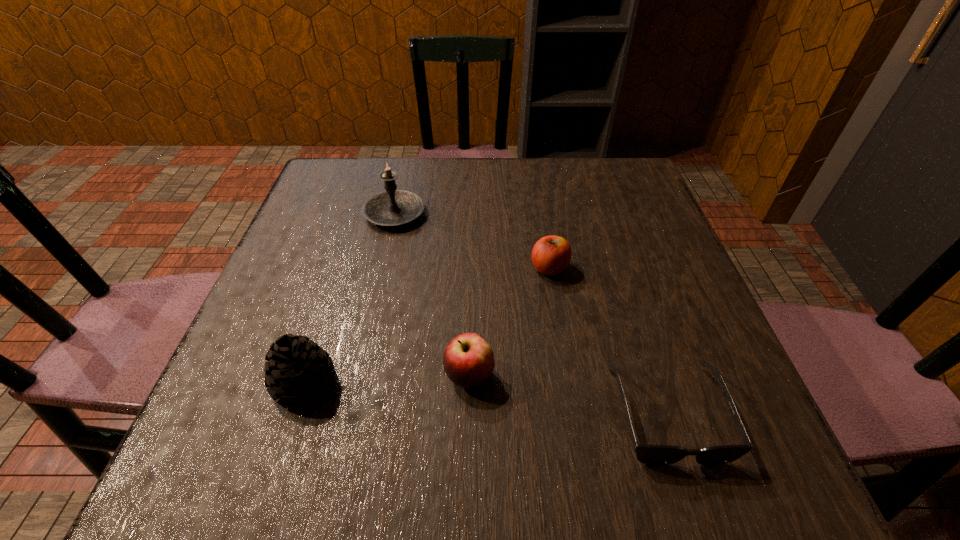
Image resolution: width=960 pixels, height=540 pixels. Find the location of `the tallest object`. the tallest object is located at coordinates (392, 207).

Where is `candle`? The width and height of the screenshot is (960, 540). candle is located at coordinates (392, 207).

Image resolution: width=960 pixels, height=540 pixels. Find the location of `the second tallest object`. the second tallest object is located at coordinates (297, 370).

Locate an element on the screen. The image size is (960, 540). the nearer apple is located at coordinates (468, 360).

This screenshot has width=960, height=540. I want to click on the left apple, so click(x=468, y=360).

I want to click on the right apple, so click(551, 255).

What are the coordinates of `the second farthest object` in the screenshot? It's located at (551, 255).

Find the location of a particular element. The width and height of the screenshot is (960, 540). the rightmost object is located at coordinates (647, 454).

Find the location of a particular element. sunglasses is located at coordinates (647, 454).

At what (x,y) coordinates should I click in order to perform the action: click on vacant space located on the front of the tallest object. Please return your answer as a coordinate pair (x, y). Looking at the image, I should click on (370, 326).